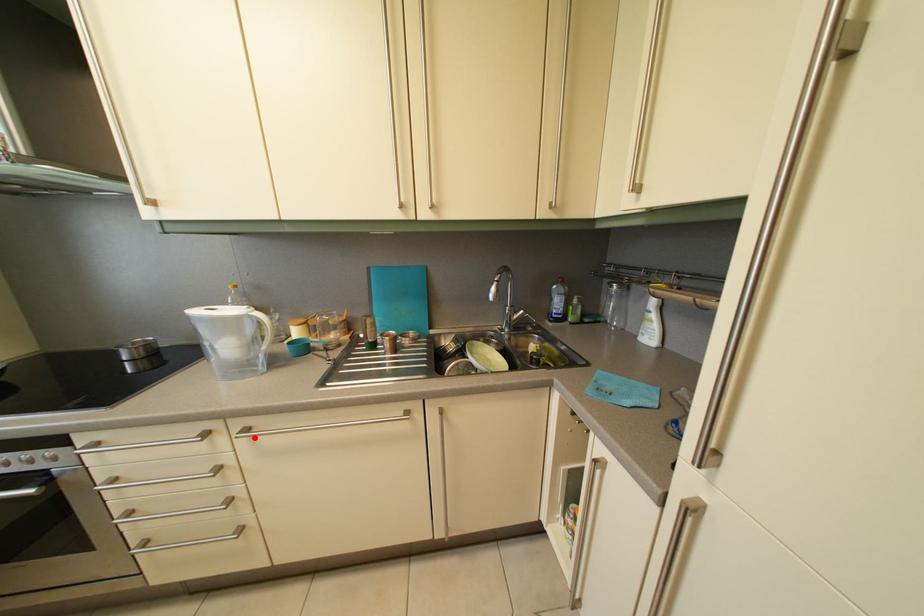
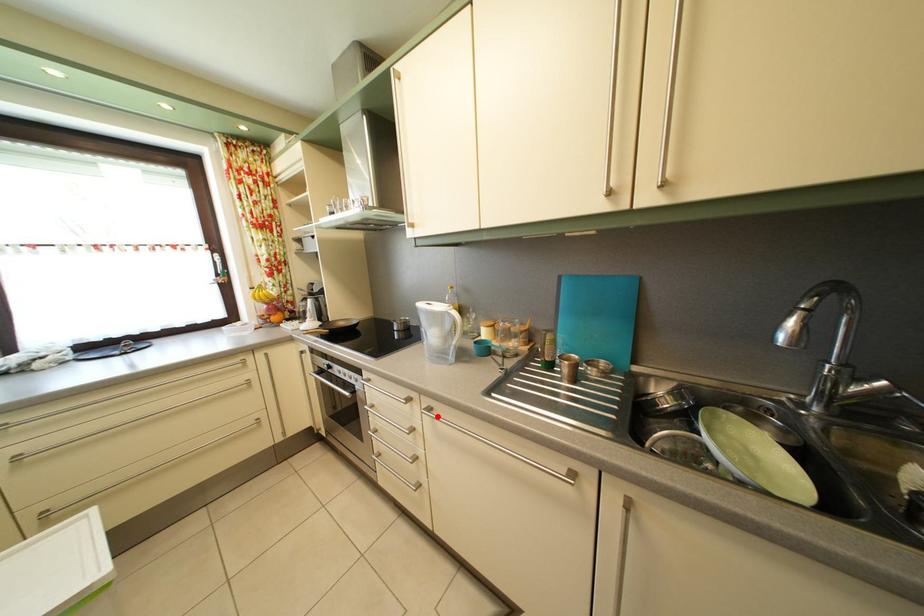
I am providing you with two images of the same scene from different viewpoints. A red point is marked on the first image and another point is marked on the second image. Does the point marked in image1 correspond to the same location as the one in image2?

Yes